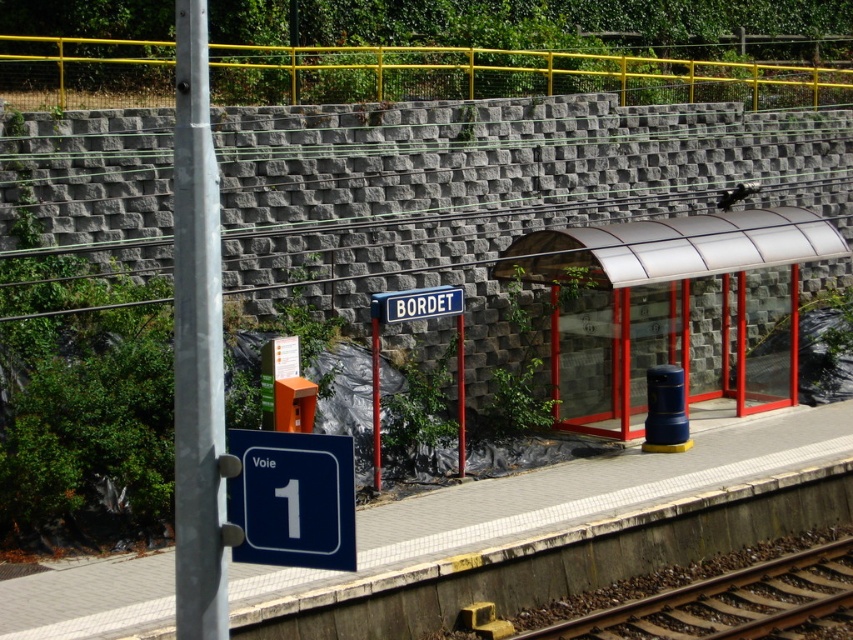
Which is behind, point (741, 618) or point (410, 310)?

Point (410, 310)

Can you confirm if brown gravel train track at lower right is positioned to the right of blue metallic sign at center?

Yes, brown gravel train track at lower right is to the right of blue metallic sign at center.

Image resolution: width=853 pixels, height=640 pixels. Describe the element at coordinates (721, 602) in the screenshot. I see `brown gravel train track at lower right` at that location.

You are a GUI agent. You are given a task and a screenshot of the screen. Output one action in this format:
    pyautogui.click(x=<x>, y=<y>)
    Task: Click on the brown gravel train track at lower right
    
    Given the screenshot: What is the action you would take?
    pyautogui.click(x=721, y=602)

Is smooth concrete platform at center smaller than metallic gray pole at left?

No, smooth concrete platform at center is not smaller than metallic gray pole at left.

Measure the distance from smooth concrete platform at center to metallic gray pole at left.

They are 9.23 meters apart.

This screenshot has height=640, width=853. Describe the element at coordinates (564, 497) in the screenshot. I see `smooth concrete platform at center` at that location.

The image size is (853, 640). I want to click on smooth concrete platform at center, so click(564, 497).

Between blue plastic sign at lower left and blue metallic sign at center, which one is positioned lower?

Positioned lower is blue metallic sign at center.

Locate an element on the screen. This screenshot has width=853, height=640. blue plastic sign at lower left is located at coordinates (292, 499).